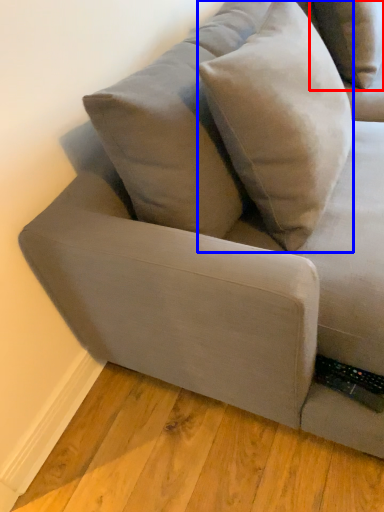
Question: Which point is closer to the camera, pillow (highlighted by a red box) or throw pillow (highlighted by a blue box)?

Choices:
 (A) pillow
 (B) throw pillow

Answer: (B)